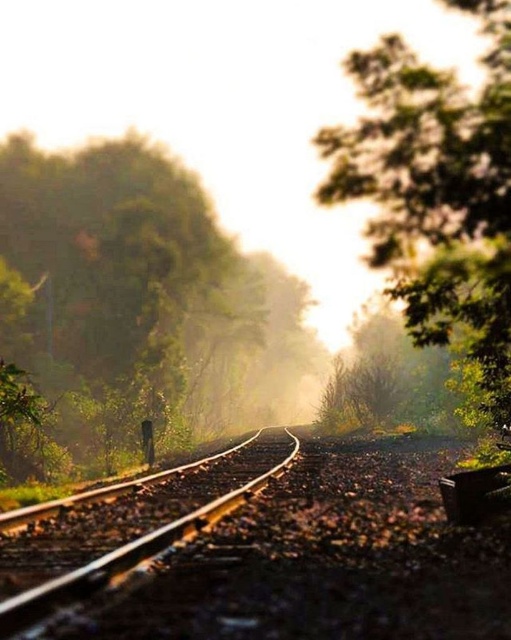
What do you see at coordinates (436, 193) in the screenshot? Image resolution: width=511 pixels, height=640 pixels. I see `green leafy tree at upper right` at bounding box center [436, 193].

Is green leafy tree at upper right positioned at the back of smooth metal train track at center?

Yes, green leafy tree at upper right is further from the viewer.

In order to click on green leafy tree at upper right in this screenshot , I will do tap(436, 193).

Can you confirm if green leafy tree at left is shorter than green leafy tree at upper right?

Yes, green leafy tree at left is shorter than green leafy tree at upper right.

Is point (28, 368) closer to viewer compared to point (330, 196)?

Yes, it is in front of point (330, 196).

Describe the element at coordinates (110, 301) in the screenshot. I see `green leafy tree at left` at that location.

At what (x,y) coordinates should I click in order to perform the action: click on green leafy tree at left. Please return your answer as a coordinate pair (x, y). Image resolution: width=511 pixels, height=640 pixels. Looking at the image, I should click on coord(110,301).

Who is more forward, (202, 256) or (66, 589)?

Positioned in front is point (66, 589).

Where is `green leafy tree at left`? The height and width of the screenshot is (640, 511). green leafy tree at left is located at coordinates click(x=110, y=301).